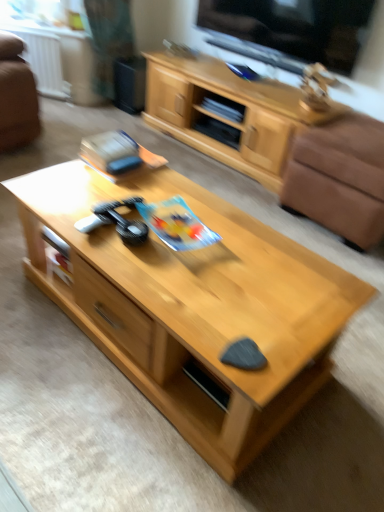
Question: Could you tell me if black glossy tv at upper center is facing white plastic radiator at upper left?

Choices:
 (A) no
 (B) yes

Answer: (A)

Question: Is black glossy tv at upper center wider than white plastic radiator at upper left?

Choices:
 (A) yes
 (B) no

Answer: (A)

Question: Is black glossy tv at upper center closer to the viewer compared to white plastic radiator at upper left?

Choices:
 (A) no
 (B) yes

Answer: (B)

Question: From a real-world perspective, is black glossy tv at upper center positioned over white plastic radiator at upper left based on gravity?

Choices:
 (A) no
 (B) yes

Answer: (B)

Question: Is black glossy tv at upper center positioned behind white plastic radiator at upper left?

Choices:
 (A) no
 (B) yes

Answer: (A)

Question: Based on their sizes in the image, would you say brown leather armchair at right is bigger or smaller than white plastic radiator at upper left?

Choices:
 (A) big
 (B) small

Answer: (A)

Question: Relative to white plastic radiator at upper left, is brown leather armchair at right in front or behind?

Choices:
 (A) behind
 (B) front

Answer: (B)

Question: Does point (342, 183) appear closer or farther from the camera than point (33, 69)?

Choices:
 (A) farther
 (B) closer

Answer: (B)

Question: Is brown leather armchair at right taller or shorter than white plastic radiator at upper left?

Choices:
 (A) short
 (B) tall

Answer: (A)

Question: From the image's perspective, is light wood cabinet at upper center above or below white plastic radiator at upper left?

Choices:
 (A) above
 (B) below

Answer: (B)

Question: Is light wood cabinet at upper center to the left or to the right of white plastic radiator at upper left in the image?

Choices:
 (A) left
 (B) right

Answer: (B)

Question: Is light wood cabinet at upper center in front of or behind white plastic radiator at upper left in the image?

Choices:
 (A) front
 (B) behind

Answer: (A)

Question: Is light wood cabinet at upper center wider or thinner than white plastic radiator at upper left?

Choices:
 (A) wide
 (B) thin

Answer: (A)

Question: Considering the relative positions of white plastic radiator at upper left and brown leather armchair at right in the image provided, is white plastic radiator at upper left to the left or to the right of brown leather armchair at right?

Choices:
 (A) left
 (B) right

Answer: (A)

Question: Is point (13, 29) closer or farther from the camera than point (319, 165)?

Choices:
 (A) closer
 (B) farther

Answer: (B)